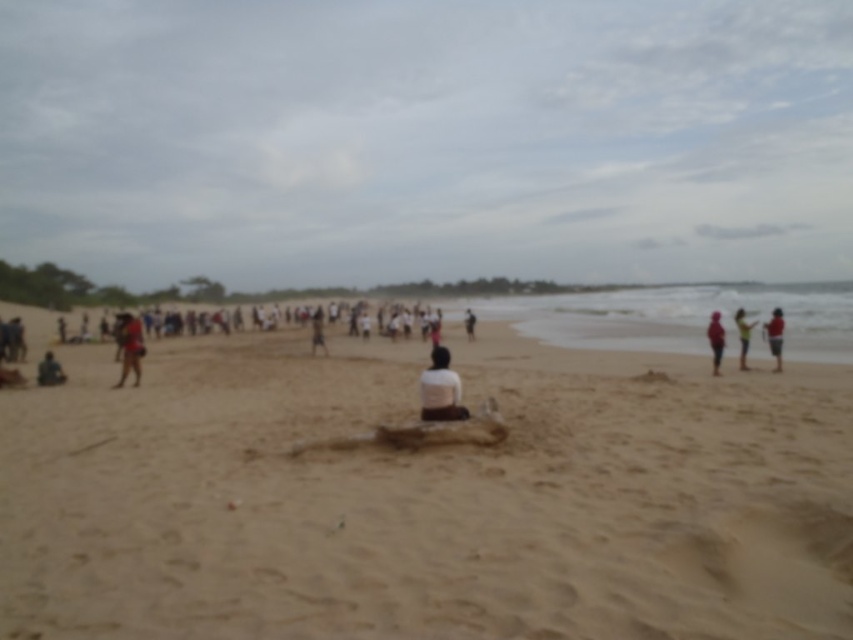
Who is positioned more to the left, matte brown backpack at left or dark gray fabric person at center?

Positioned to the left is matte brown backpack at left.

Between matte brown backpack at left and dark gray fabric person at center, which one appears on the right side from the viewer's perspective?

From the viewer's perspective, dark gray fabric person at center appears more on the right side.

Who is more distant from viewer, [138,355] or [466,320]?

The point [466,320] is more distant.

The height and width of the screenshot is (640, 853). What are the coordinates of `matte brown backpack at left` in the screenshot? It's located at click(x=131, y=348).

Who is higher up, sandy beach at center or white matte shirt at center?

white matte shirt at center is higher up.

Can you confirm if sandy beach at center is taller than white matte shirt at center?

Correct, sandy beach at center is much taller as white matte shirt at center.

Who is more forward, (666, 355) or (422, 387)?

Point (422, 387)

Locate an element on the screen. This screenshot has height=640, width=853. sandy beach at center is located at coordinates (424, 497).

Who is higher up, sandy beach at center or light brown fabric shirt at center?

light brown fabric shirt at center

Which of these two, sandy beach at center or light brown fabric shirt at center, stands shorter?

Standing shorter between the two is sandy beach at center.

Find the location of a particular element. sandy beach at center is located at coordinates coord(424,497).